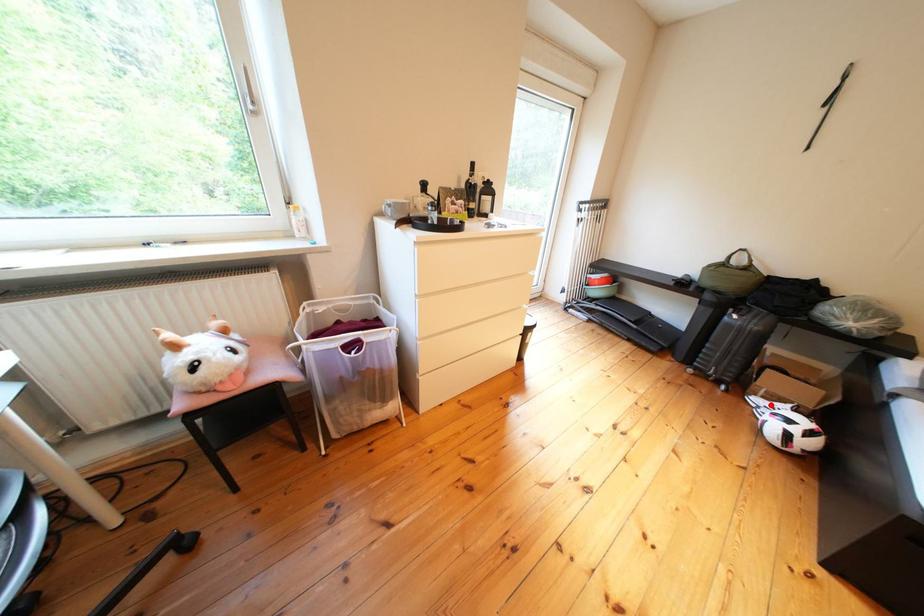
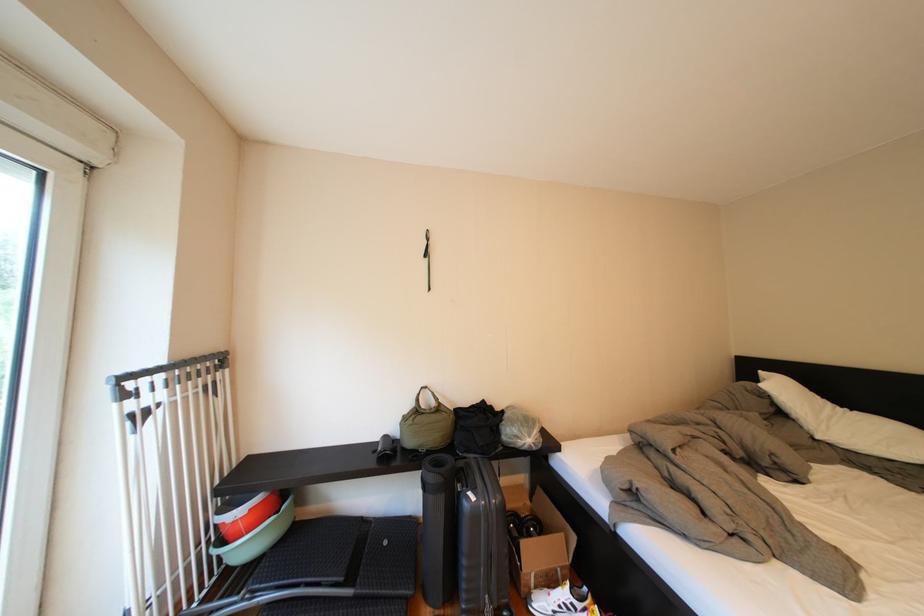
Locate, in the second image, the point that corresponds to the highlighted location in the first image.

(554, 609)